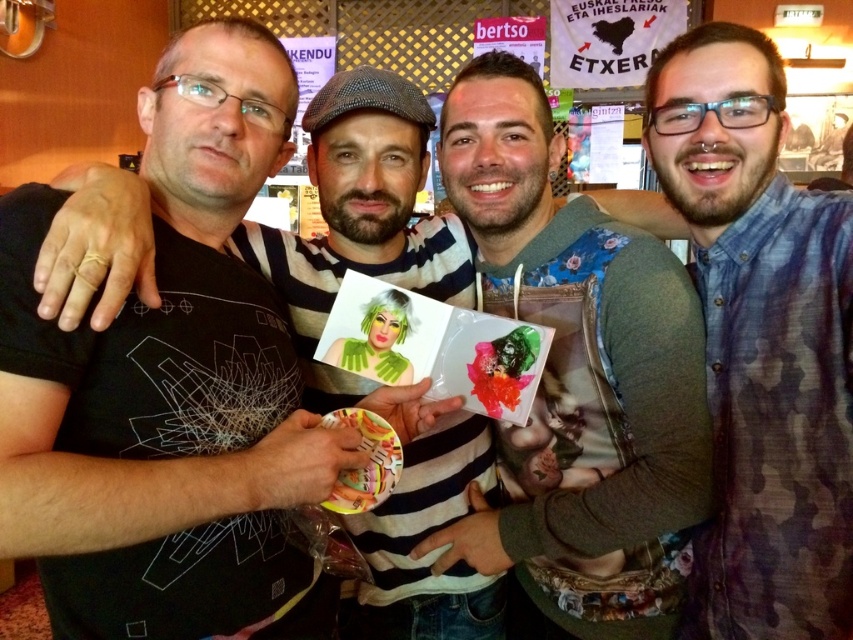
Question: Estimate the real-world distances between objects in this image. Which object is farther from the black matte t-shirt at center?

Choices:
 (A) blue camouflage shirt at center
 (B) floral-patterned hoodie at center

Answer: (A)

Question: Which of these objects is positioned closest to the blue camouflage shirt at center?

Choices:
 (A) black matte t-shirt at center
 (B) floral-patterned hoodie at center

Answer: (B)

Question: Which object is the farthest from the blue camouflage shirt at center?

Choices:
 (A) floral-patterned hoodie at center
 (B) black matte t-shirt at center

Answer: (B)

Question: Can you confirm if black matte t-shirt at center is thinner than blue camouflage shirt at center?

Choices:
 (A) yes
 (B) no

Answer: (B)

Question: Is black matte t-shirt at center above floral-patterned hoodie at center?

Choices:
 (A) yes
 (B) no

Answer: (A)

Question: From the image, what is the correct spatial relationship of floral-patterned hoodie at center in relation to blue camouflage shirt at center?

Choices:
 (A) below
 (B) above

Answer: (A)